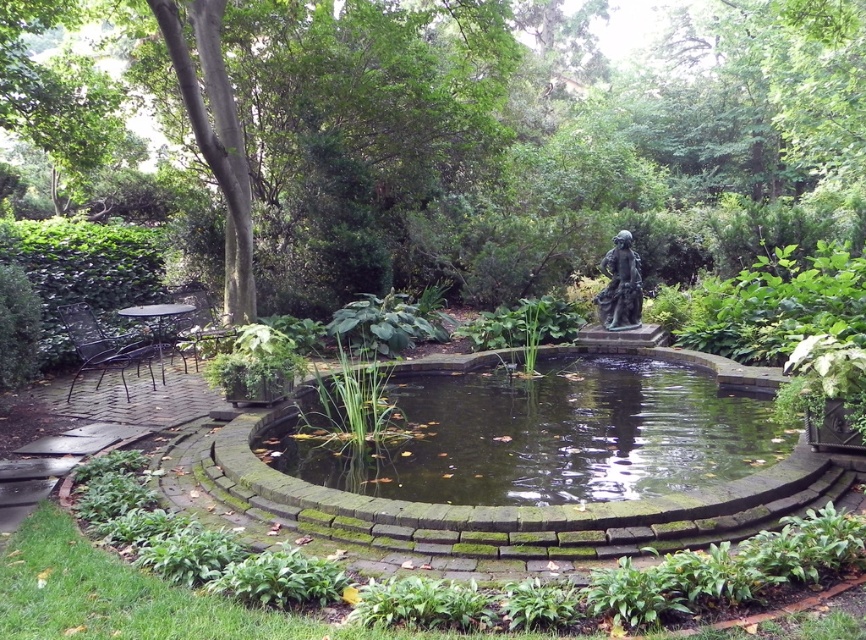
Consider the image. Is green leafy tree at center positioned in front of green mossy stone pond at center?

That is False.

Is point (309, 225) less distant than point (709, 449)?

That is False.

What are the coordinates of `green leafy tree at center` in the screenshot? It's located at (460, 138).

Where is `green mossy stone pond at center`? This screenshot has width=866, height=640. green mossy stone pond at center is located at coordinates (548, 435).

Can you confirm if green mossy stone pond at center is smaller than bronze statue at center?

No, green mossy stone pond at center is not smaller than bronze statue at center.

Who is more distant from viewer, (541, 390) or (612, 304)?

The point (612, 304) is more distant.

This screenshot has width=866, height=640. Find the location of `green mossy stone pond at center`. green mossy stone pond at center is located at coordinates (548, 435).

Can you confirm if green leafy tree at center is shorter than bronze statue at center?

No, green leafy tree at center is not shorter than bronze statue at center.

Looking at this image, is green leafy tree at center bigger than bronze statue at center?

Correct, green leafy tree at center is larger in size than bronze statue at center.

This screenshot has width=866, height=640. What do you see at coordinates (460, 138) in the screenshot?
I see `green leafy tree at center` at bounding box center [460, 138].

Where is `green leafy tree at center`? Image resolution: width=866 pixels, height=640 pixels. green leafy tree at center is located at coordinates (460, 138).